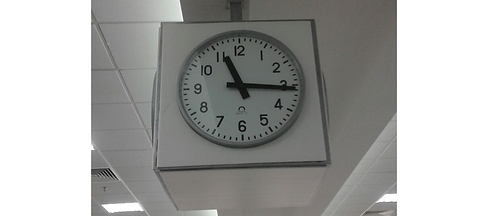
The width and height of the screenshot is (502, 216). In order to click on white clock face in this screenshot , I will do `click(218, 93)`.